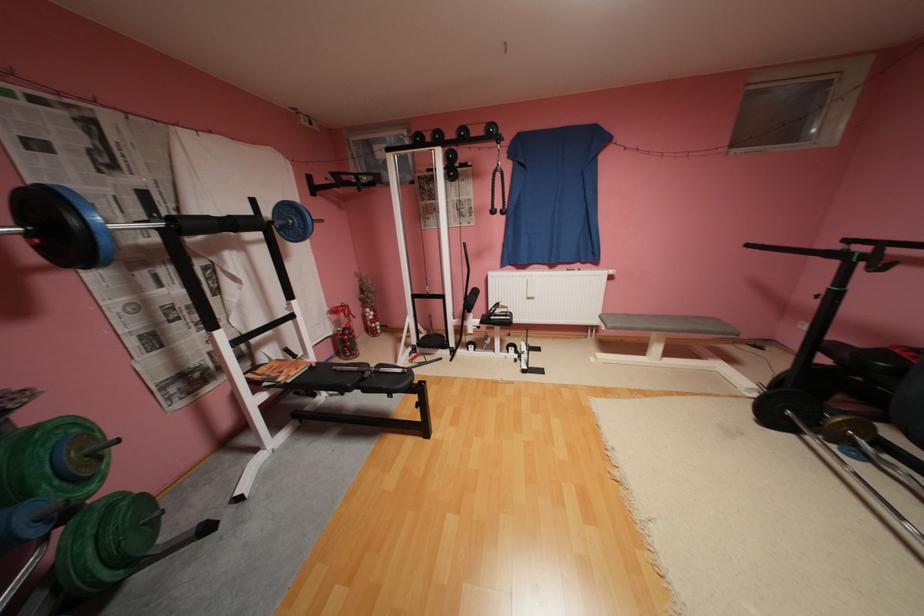
This screenshot has width=924, height=616. What do you see at coordinates (333, 378) in the screenshot? I see `the black bench surface` at bounding box center [333, 378].